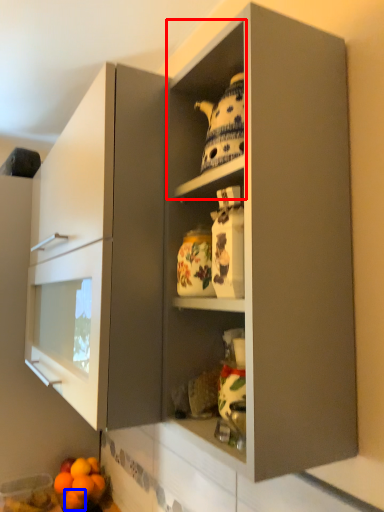
Question: Among these objects, which one is nearest to the camera, cabinet (highlighted by a red box) or orange (highlighted by a blue box)?

Choices:
 (A) cabinet
 (B) orange

Answer: (A)